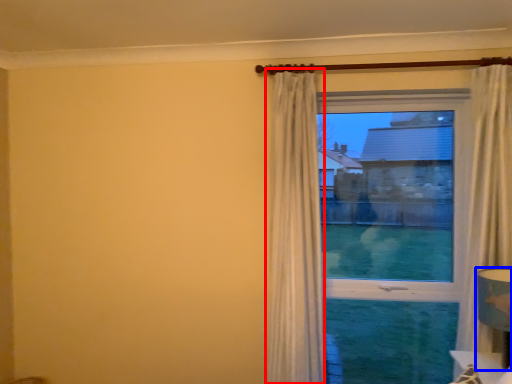
Question: Which object is closer to the camera taking this photo, curtain (highlighted by a red box) or table lamp (highlighted by a blue box)?

Choices:
 (A) curtain
 (B) table lamp

Answer: (B)